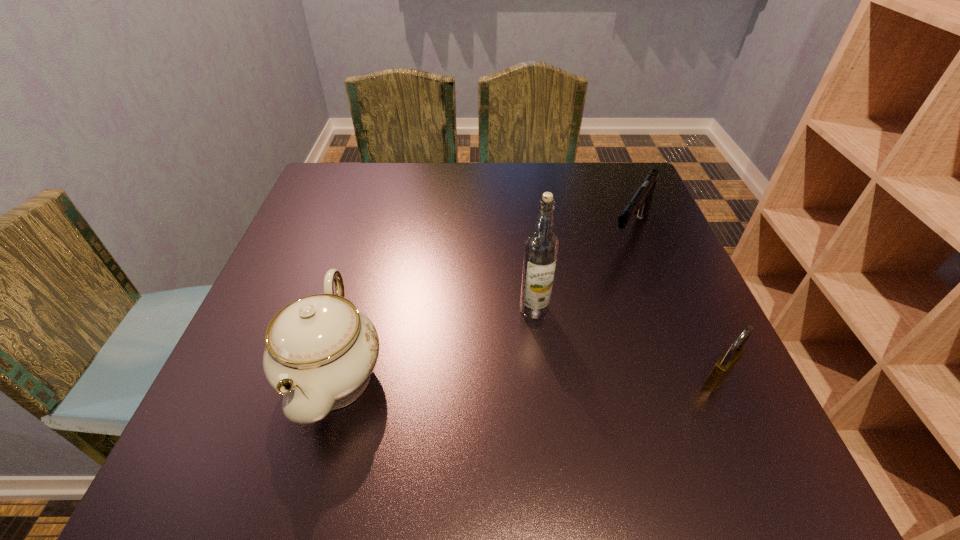
You are a GUI agent. You are given a task and a screenshot of the screen. Output one action in this format:
    pyautogui.click(x=<x>, y=<y>)
    Task: Click on the object present at the far right corner
    Image resolution: width=960 pixels, height=540 pixels.
    Given the screenshot: What is the action you would take?
    pyautogui.click(x=640, y=203)

Identify the location of object that is at the near right corner. (727, 361).

Where is `free location at the far edge of the desktop`? The image size is (960, 540). free location at the far edge of the desktop is located at coordinates (480, 190).

This screenshot has width=960, height=540. Find the location of `free space at the near edge of the desktop`. free space at the near edge of the desktop is located at coordinates (411, 389).

Locate an element on the screen. vacant area at the left edge of the desktop is located at coordinates (313, 278).

The height and width of the screenshot is (540, 960). I want to click on free space at the right edge of the desktop, so click(637, 342).

At what (x,y) coordinates should I click in order to perform the action: click on vacant space at the far left corner of the desktop. Please return your answer as a coordinate pair (x, y). The width and height of the screenshot is (960, 540). Looking at the image, I should click on point(324,181).

The image size is (960, 540). In order to click on free region at the near left corner of the desktop in this screenshot , I will do `click(260, 416)`.

This screenshot has width=960, height=540. I want to click on vacant space at the far right corner of the desktop, so click(x=618, y=166).

The width and height of the screenshot is (960, 540). Identify the location of free location at the near right corner. (718, 399).